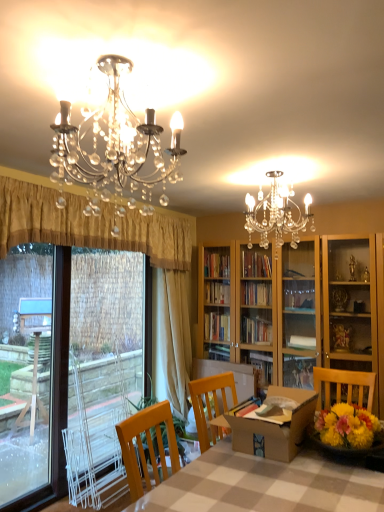
Question: Considering the positions of point [x=152, y=315] and point [x=99, y=266], is point [x=152, y=315] closer or farther from the camera than point [x=99, y=266]?

Choices:
 (A) farther
 (B) closer

Answer: (A)

Question: From a real-world perspective, is beige fabric curtain at left, acting as the 2th curtain starting from the front, physically located above or below clear plastic screen door at left?

Choices:
 (A) above
 (B) below

Answer: (A)

Question: Estimate the real-world distances between objects in this image. Which object is closer to the checkered fabric table at center?

Choices:
 (A) brown cardboard box at center
 (B) clear plastic screen door at left
 (C) beige fabric curtain at left, acting as the 1th curtain starting from the back
 (D) gold pleated curtain at left, the second curtain positioned from the back

Answer: (A)

Question: Estimate the real-world distances between objects in this image. Which object is closer to the brown cardboard box at center?

Choices:
 (A) beige fabric curtain at left, acting as the 1th curtain starting from the back
 (B) gold pleated curtain at left, placed as the 1th curtain when sorted from front to back
 (C) checkered fabric table at center
 (D) clear plastic screen door at left

Answer: (C)